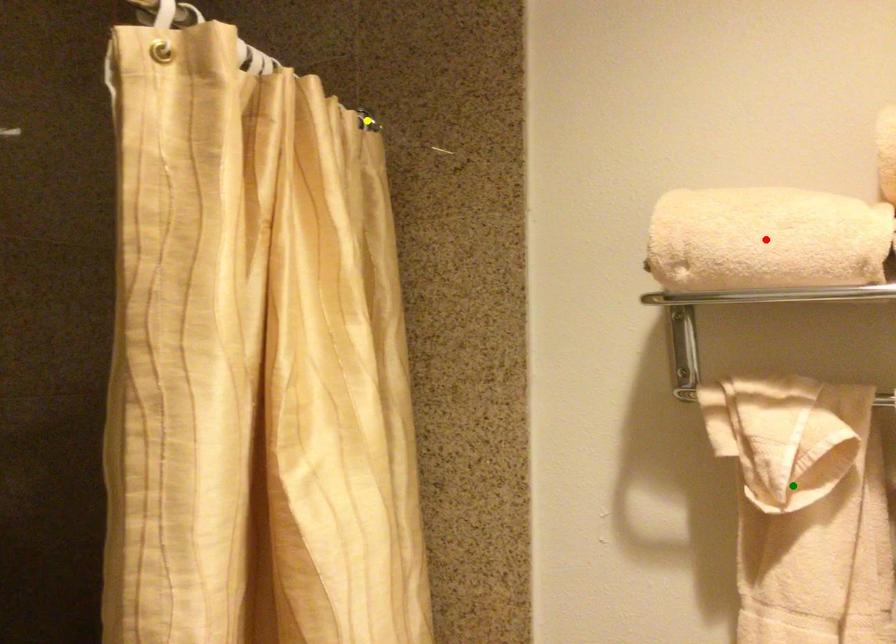
Order these from nearest to farthest:
green point
yellow point
red point

1. red point
2. green point
3. yellow point